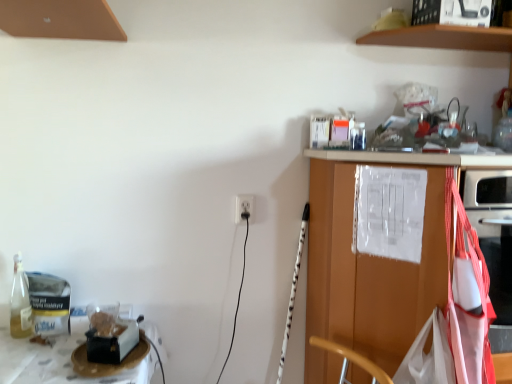
Question: Considering their positions, is white plastic electric outlet at center located in front of or behind brown wooden shelf at upper center?

Choices:
 (A) behind
 (B) front

Answer: (A)

Question: From the image's perspective, is white plastic electric outlet at center positioned above or below brown wooden shelf at upper center?

Choices:
 (A) below
 (B) above

Answer: (A)

Question: Which object is the farthest from the wooden cabinet at right?

Choices:
 (A) brown wooden shelf at upper center
 (B) white plastic electric outlet at center

Answer: (A)

Question: Estimate the real-world distances between objects in this image. Which object is closer to the white plastic electric outlet at center?

Choices:
 (A) wooden cabinet at right
 (B) brown wooden shelf at upper center

Answer: (A)